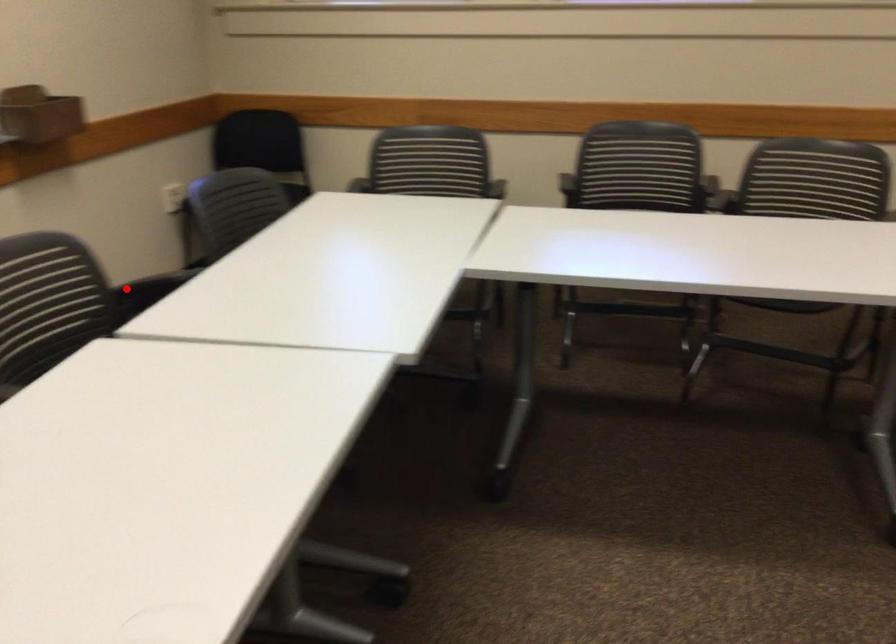
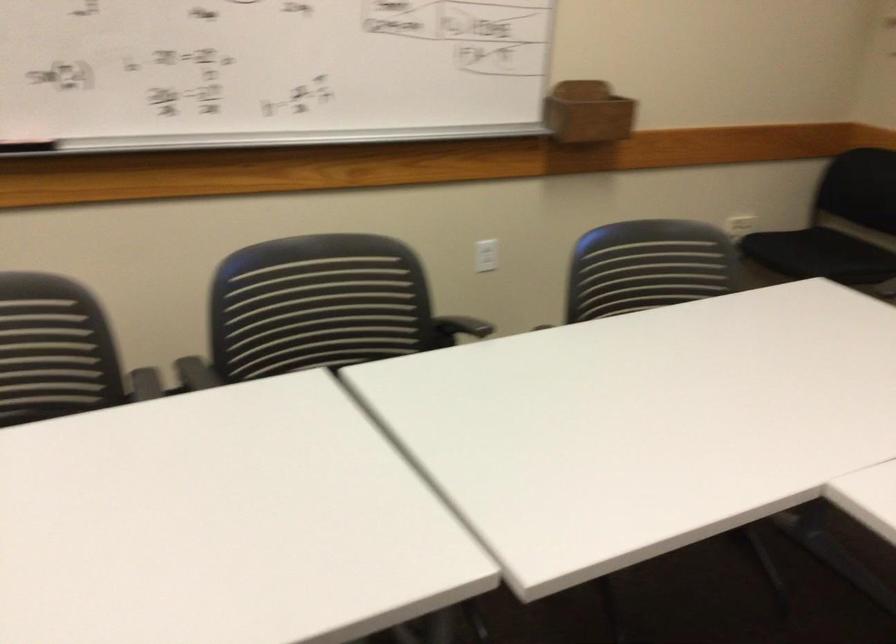
Question: I am providing you with two images of the same scene from different viewpoints. A red point is marked on the first image. At the location where the point appears in image 1, is it still visible in image 2?

Choices:
 (A) Yes
 (B) No

Answer: (A)